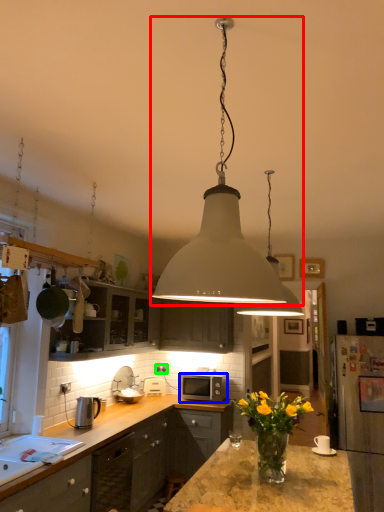
Question: Which is nearer to the lamp (highlighted by a red box)? microwave oven (highlighted by a blue box) or electric outlet (highlighted by a green box).

Choices:
 (A) microwave oven
 (B) electric outlet

Answer: (A)